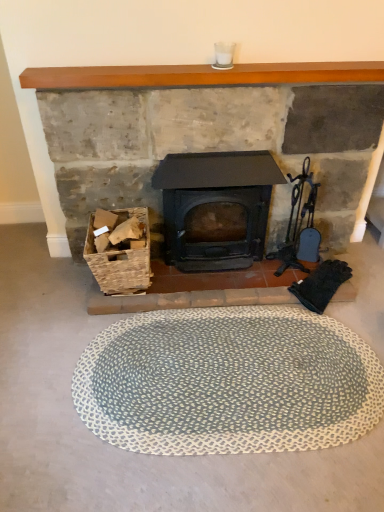
You are a GUI agent. You are given a task and a screenshot of the screen. Output one action in this format:
    pyautogui.click(x=<x>, y=<y>)
    Task: Click on the vacant location below wooden mantlepiece at upper center (from a real-world perspective)
    
    Given the screenshot: What is the action you would take?
    pyautogui.click(x=209, y=86)